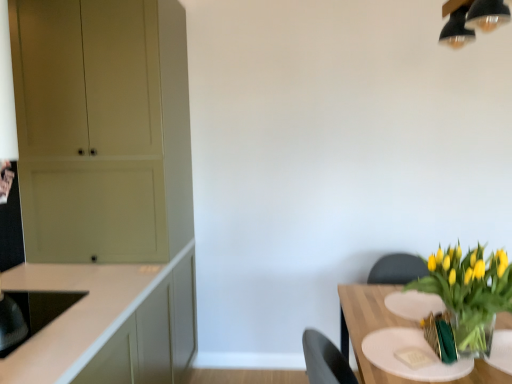
Question: Does black glossy sink at lower left contain white matte cabinet at left, arranged as the second cabinetry when viewed from the back?

Choices:
 (A) no
 (B) yes

Answer: (A)

Question: From a real-world perspective, is black glossy sink at lower left over white matte cabinet at left, positioned as the 1th cabinetry in front-to-back order?

Choices:
 (A) yes
 (B) no

Answer: (A)

Question: Does black glossy sink at lower left lie in front of white matte cabinet at left, arranged as the second cabinetry when viewed from the back?

Choices:
 (A) no
 (B) yes

Answer: (A)

Question: Is black glossy sink at lower left taller than white matte cabinet at left, arranged as the second cabinetry when viewed from the back?

Choices:
 (A) yes
 (B) no

Answer: (B)

Question: Is black glossy sink at lower left to the left of white matte cabinet at left, positioned as the 1th cabinetry in front-to-back order, from the viewer's perspective?

Choices:
 (A) no
 (B) yes

Answer: (B)

Question: Considering their positions, is black glossy sink at lower left located in front of or behind translucent glass vase at lower right?

Choices:
 (A) front
 (B) behind

Answer: (B)

Question: Is black glossy sink at lower left situated inside translucent glass vase at lower right or outside?

Choices:
 (A) outside
 (B) inside

Answer: (A)

Question: Does point (34, 329) appear closer or farther from the camera than point (454, 274)?

Choices:
 (A) farther
 (B) closer

Answer: (A)

Question: In terms of height, does black glossy sink at lower left look taller or shorter compared to translucent glass vase at lower right?

Choices:
 (A) tall
 (B) short

Answer: (B)

Question: From the image's perspective, relative to translucent glass table at lower right, is black glossy sink at lower left above or below?

Choices:
 (A) above
 (B) below

Answer: (A)

Question: From their relative heights in the image, would you say black glossy sink at lower left is taller or shorter than translucent glass table at lower right?

Choices:
 (A) short
 (B) tall

Answer: (A)

Question: Is black glossy sink at lower left wider or thinner than translucent glass table at lower right?

Choices:
 (A) thin
 (B) wide

Answer: (A)

Question: In the image, is black glossy sink at lower left on the left side or the right side of translucent glass table at lower right?

Choices:
 (A) left
 (B) right

Answer: (A)

Question: Which is correct: translucent glass table at lower right is inside white matte cabinet at left, positioned as the 1th cabinetry in front-to-back order, or outside of it?

Choices:
 (A) outside
 (B) inside

Answer: (A)

Question: In terms of height, does translucent glass table at lower right look taller or shorter compared to white matte cabinet at left, positioned as the 1th cabinetry in front-to-back order?

Choices:
 (A) tall
 (B) short

Answer: (B)